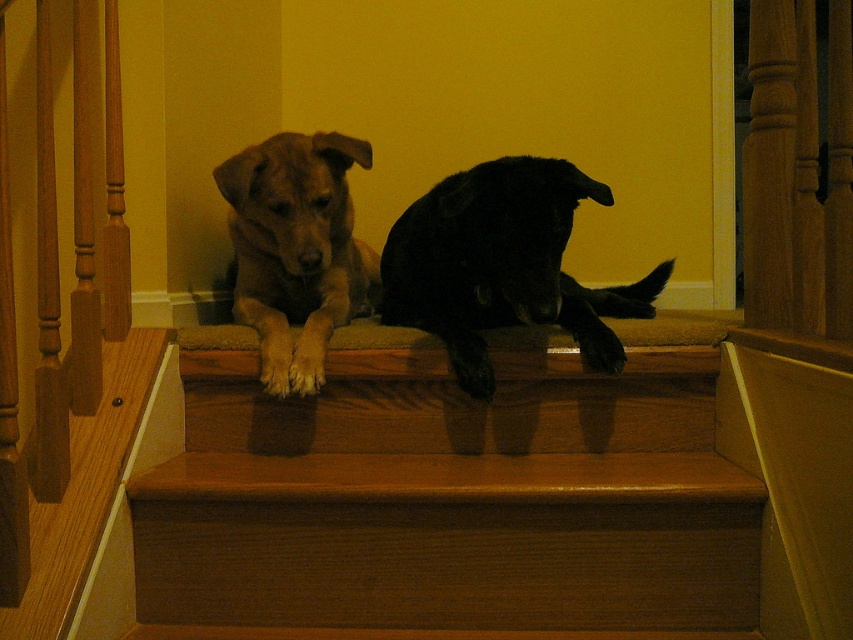
Is point (573, 362) positioned in front of point (466, 355)?

No.

Is brown wood stairs at center bigger than black matte dog at center?

No, brown wood stairs at center is not bigger than black matte dog at center.

Find the location of a particular element. The width and height of the screenshot is (853, 640). brown wood stairs at center is located at coordinates (450, 502).

At what (x,y) coordinates should I click in order to perform the action: click on brown wood stairs at center. Please return your answer as a coordinate pair (x, y). The width and height of the screenshot is (853, 640). Looking at the image, I should click on (450, 502).

This screenshot has width=853, height=640. Identify the location of brown wood stairs at center. (450, 502).

Can you confirm if brown wood stairs at center is positioned to the right of brown fur dog at center?

Yes, brown wood stairs at center is to the right of brown fur dog at center.

In the scene shown: Who is more distant from viewer, (650, 497) or (341, 202)?

Point (341, 202)

Where is `brown wood stairs at center`? The width and height of the screenshot is (853, 640). brown wood stairs at center is located at coordinates (450, 502).

Who is lower down, brown fur dog at center or black matte paw at center?

Positioned lower is black matte paw at center.

Does brown fur dog at center appear under black matte paw at center?

Incorrect, brown fur dog at center is not positioned below black matte paw at center.

Is point (306, 282) farther from viewer compared to point (590, 362)?

Yes, it is.

At what (x,y) coordinates should I click in order to perform the action: click on brown fur dog at center. Please return your answer as a coordinate pair (x, y). The height and width of the screenshot is (640, 853). Looking at the image, I should click on (296, 250).